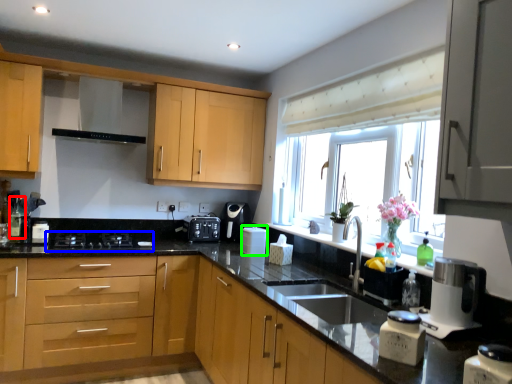
Question: Which object is the closest to the bottle (highlighted by a red box)? Choose among these: gas stove (highlighted by a blue box) or appliance (highlighted by a green box).

Choices:
 (A) gas stove
 (B) appliance

Answer: (A)